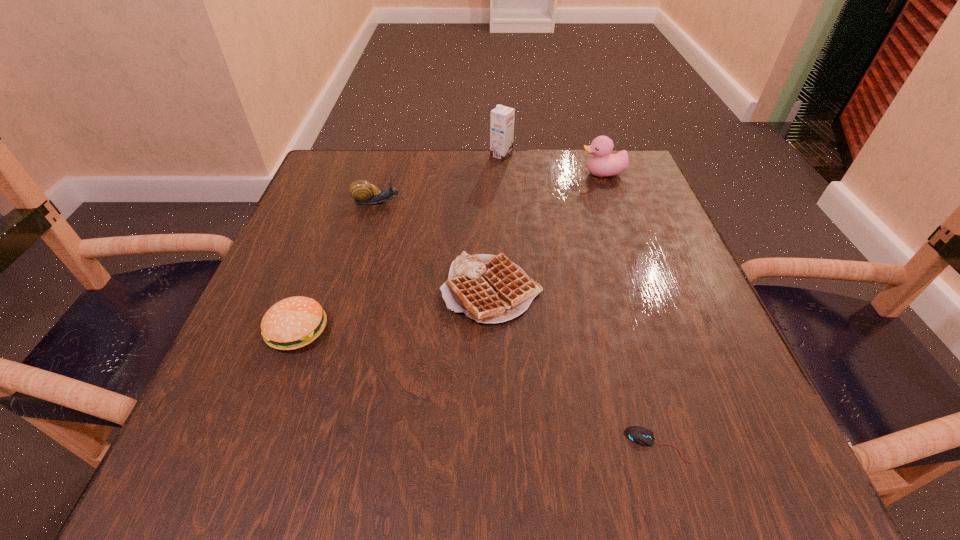
You are a GUI agent. You are given a task and a screenshot of the screen. Output one action in this format:
    pyautogui.click(x=<x>, y=<y>)
    Task: Click on the vacant space at the near edge
    
    Given the screenshot: What is the action you would take?
    (x=467, y=438)

Find the location of a particular element. vacant space at the left edge of the desktop is located at coordinates (342, 210).

Image resolution: width=960 pixels, height=540 pixels. I want to click on free space at the right edge of the desktop, so coord(676,333).

In the image, there is a desktop. At what (x,y) coordinates should I click in order to perform the action: click on vacant space at the far left corner. Please return your answer as a coordinate pair (x, y). The image size is (960, 540). Looking at the image, I should click on (362, 171).

Image resolution: width=960 pixels, height=540 pixels. In order to click on free space that is in between the patty and the fifth tallest object in this screenshot , I will do `click(395, 310)`.

Identify the location of free space between the chocolate milk and the nearest object. (579, 300).

Where is `free space between the fourth nearest object and the patty`? The width and height of the screenshot is (960, 540). free space between the fourth nearest object and the patty is located at coordinates (338, 266).

The height and width of the screenshot is (540, 960). What are the coordinates of `free space that is in between the mouse and the escargot` in the screenshot? It's located at (517, 323).

I want to click on vacant area that lies between the fourth shortest object and the second farthest object, so click(491, 188).

Identify the location of free area in between the third farthest object and the fifth shortest object. The height and width of the screenshot is (540, 960). (491, 188).